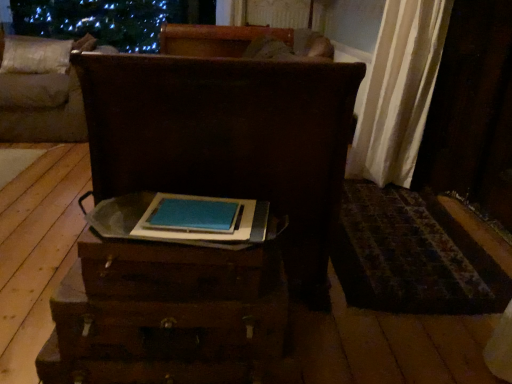
Question: Can you confirm if wooden trunk at center, the first furniture when ordered from front to back, is shorter than blue matte book at center?

Choices:
 (A) yes
 (B) no

Answer: (B)

Question: Is wooden trunk at center, marked as the first furniture in a right-to-left arrangement, taller than blue matte book at center?

Choices:
 (A) yes
 (B) no

Answer: (A)

Question: From a real-world perspective, is wooden trunk at center, the second furniture viewed from the left, located beneath blue matte book at center?

Choices:
 (A) no
 (B) yes

Answer: (B)

Question: Is wooden trunk at center, marked as the first furniture in a right-to-left arrangement, thinner than blue matte book at center?

Choices:
 (A) no
 (B) yes

Answer: (A)

Question: Is wooden trunk at center, the first furniture when ordered from front to back, at the right side of blue matte book at center?

Choices:
 (A) no
 (B) yes

Answer: (A)

Question: Is blue matte book at center located within wooden trunk at center, which is the second furniture in back-to-front order?

Choices:
 (A) no
 (B) yes

Answer: (A)

Question: From a real-world perspective, is beige fabric pillow at upper left over wooden trunk at center, marked as the first furniture in a right-to-left arrangement?

Choices:
 (A) no
 (B) yes

Answer: (B)

Question: Is beige fabric pillow at upper left positioned in front of wooden trunk at center, marked as the first furniture in a right-to-left arrangement?

Choices:
 (A) no
 (B) yes

Answer: (A)

Question: Does beige fabric pillow at upper left have a lesser height compared to wooden trunk at center, which is the second furniture in back-to-front order?

Choices:
 (A) no
 (B) yes

Answer: (B)

Question: From the image's perspective, is beige fabric pillow at upper left under wooden trunk at center, the first furniture when ordered from front to back?

Choices:
 (A) no
 (B) yes

Answer: (A)

Question: Is beige fabric pillow at upper left positioned with its back to wooden trunk at center, which is the second furniture in back-to-front order?

Choices:
 (A) yes
 (B) no

Answer: (B)

Question: Is beige fabric pillow at upper left not within wooden trunk at center, which is the second furniture in back-to-front order?

Choices:
 (A) yes
 (B) no

Answer: (A)

Question: Can we say beige fabric pillow at upper left lies outside brown wooden chest at upper left, which ranks as the 1th furniture in left-to-right order?

Choices:
 (A) yes
 (B) no

Answer: (B)